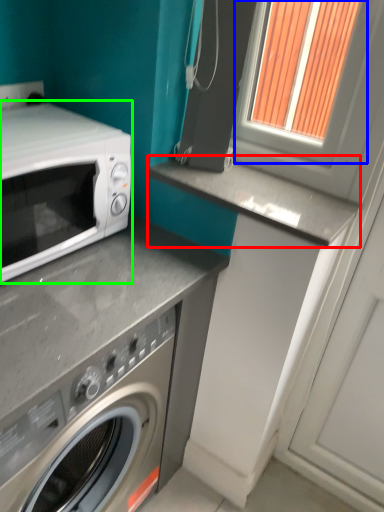
Question: Which is nearer to the counter top (highlighted by a red box)? window frame (highlighted by a blue box) or microwave oven (highlighted by a green box).

Choices:
 (A) window frame
 (B) microwave oven

Answer: (A)